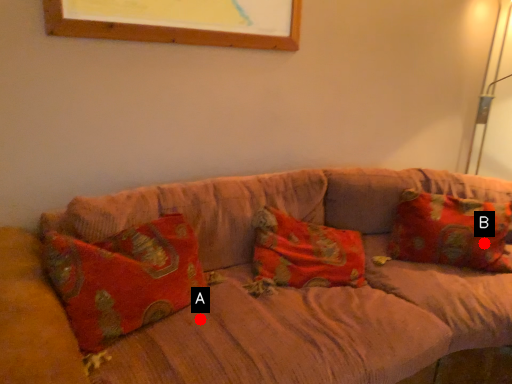
Question: Two points are circled on the image, labeled by A and B beside each circle. Which point appears farthest from the camera in this image?

Choices:
 (A) A is further
 (B) B is further

Answer: (B)